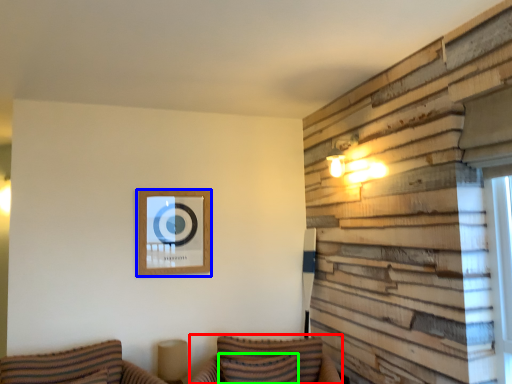
Question: Which object is the farthest from couch (highlighted by a red box)? Choose among these: picture frame (highlighted by a blue box) or pillow (highlighted by a green box).

Choices:
 (A) picture frame
 (B) pillow

Answer: (A)